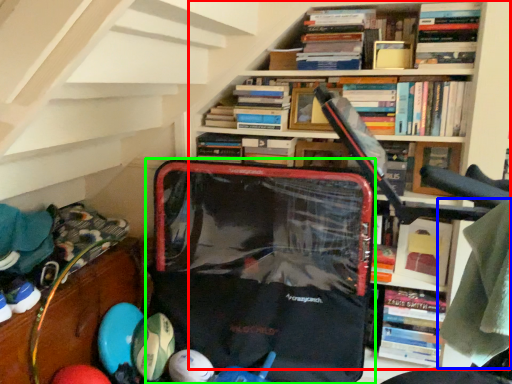
Question: Estimate the real-world distances between objects in this image. Which object is farther from bookcase (highlighted by a red box), clothing (highlighted by a blue box) or pack (highlighted by a green box)?

Choices:
 (A) clothing
 (B) pack

Answer: (A)